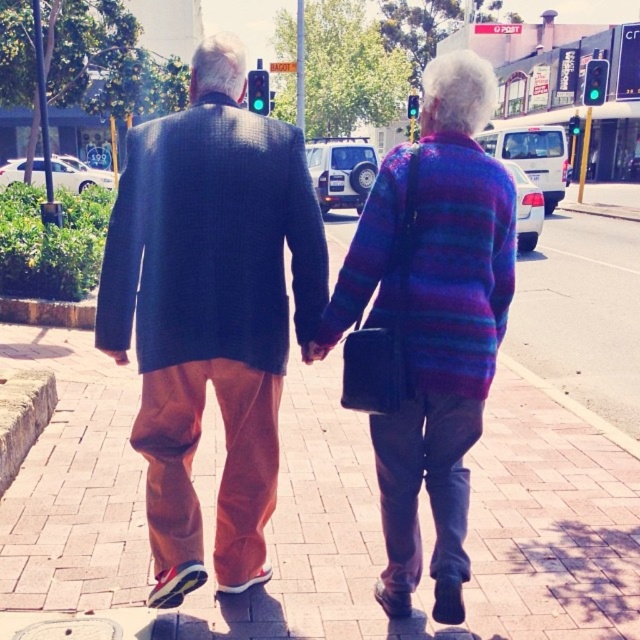
Measure the distance between point (205, 513) and camera.

Point (205, 513) and camera are 11.73 feet apart from each other.

Looking at this image, which is more to the left, brick pavement at center or textured navy blazer at center?

From the viewer's perspective, textured navy blazer at center appears more on the left side.

Which is behind, point (26, 522) or point (193, 536)?

The point (26, 522) is more distant.

Identify the location of brick pavement at center. (476, 477).

Is textured navy blazer at center below purple striped sweater at center?

Actually, textured navy blazer at center is above purple striped sweater at center.

Does textured navy blazer at center have a lesser height compared to purple striped sweater at center?

No, textured navy blazer at center is not shorter than purple striped sweater at center.

Identify the location of textured navy blazer at center. (211, 310).

Is brick pavement at center smaller than purple striped sweater at center?

No.

Measure the distance between brick pavement at center and camera.

The distance of brick pavement at center from camera is 8.28 feet.

Between point (630, 577) and point (456, 310), which one is positioned in front?

Positioned in front is point (456, 310).

Locate an element on the screen. brick pavement at center is located at coordinates (476, 477).